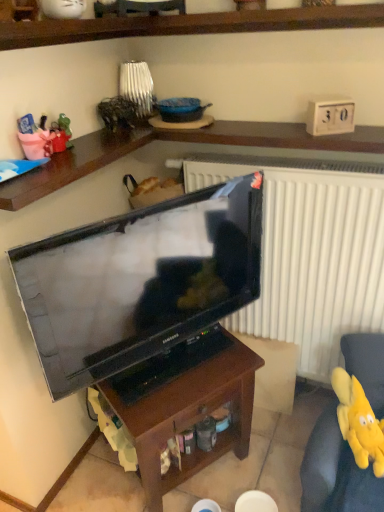
Question: Does brown wood table at center come in front of yellow plush toy at lower right?

Choices:
 (A) no
 (B) yes

Answer: (B)

Question: Could you tell me if brown wood table at center is facing yellow plush toy at lower right?

Choices:
 (A) no
 (B) yes

Answer: (A)

Question: Is brown wood table at center at the right side of yellow plush toy at lower right?

Choices:
 (A) no
 (B) yes

Answer: (A)

Question: Is brown wood table at center in contact with yellow plush toy at lower right?

Choices:
 (A) yes
 (B) no

Answer: (B)

Question: Would you say brown wood table at center is a long distance from yellow plush toy at lower right?

Choices:
 (A) yes
 (B) no

Answer: (B)

Question: From the image's perspective, does brown wood table at center appear lower than yellow plush toy at lower right?

Choices:
 (A) yes
 (B) no

Answer: (A)

Question: Is yellow plush toy at lower right not near yellow plush toy at lower right?

Choices:
 (A) yes
 (B) no

Answer: (B)

Question: Is yellow plush toy at lower right behind yellow plush toy at lower right?

Choices:
 (A) no
 (B) yes

Answer: (A)

Question: Does yellow plush toy at lower right turn towards yellow plush toy at lower right?

Choices:
 (A) no
 (B) yes

Answer: (B)

Question: Is yellow plush toy at lower right not inside yellow plush toy at lower right?

Choices:
 (A) no
 (B) yes

Answer: (B)

Question: Can you confirm if yellow plush toy at lower right is smaller than yellow plush toy at lower right?

Choices:
 (A) no
 (B) yes

Answer: (A)

Question: Is yellow plush toy at lower right wider than yellow plush toy at lower right?

Choices:
 (A) no
 (B) yes

Answer: (B)

Question: Is brown wood table at center shorter than matte black television at center?

Choices:
 (A) yes
 (B) no

Answer: (A)